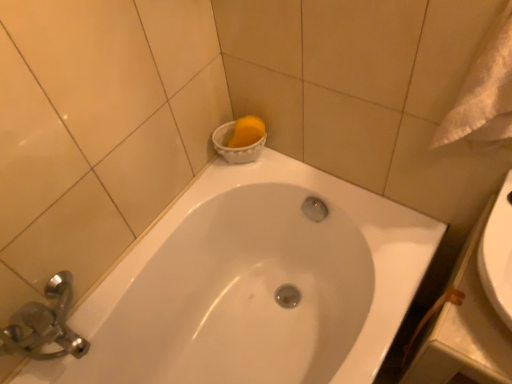
What do you see at coordinates (254, 285) in the screenshot? I see `white glossy bathtub at upper center` at bounding box center [254, 285].

At what (x,y) coordinates should I click in order to perform the action: click on white glossy bathtub at upper center. Please return your answer as a coordinate pair (x, y). Looking at the image, I should click on (254, 285).

The height and width of the screenshot is (384, 512). In order to click on white textured towel at upper right in this screenshot , I will do `click(484, 93)`.

This screenshot has height=384, width=512. Describe the element at coordinates (484, 93) in the screenshot. I see `white textured towel at upper right` at that location.

Where is `white glossy bathtub at upper center`? white glossy bathtub at upper center is located at coordinates (254, 285).

Between white glossy bathtub at upper center and white textured towel at upper right, which one appears on the left side from the viewer's perspective?

From the viewer's perspective, white glossy bathtub at upper center appears more on the left side.

Between white glossy bathtub at upper center and white textured towel at upper right, which one is positioned in front?

white textured towel at upper right is more forward.

Which is in front, point (434, 231) or point (492, 64)?

The point (492, 64) is closer.

From the image's perspective, which is below, white glossy bathtub at upper center or white textured towel at upper right?

white glossy bathtub at upper center.

Based on the photo, from a real-world perspective, which object stands above the other?

In real-world perspective, white textured towel at upper right is above.

Which object is thinner, white glossy bathtub at upper center or white textured towel at upper right?

With smaller width is white textured towel at upper right.

In terms of height, does white glossy bathtub at upper center look taller or shorter compared to white textured towel at upper right?

In the image, white glossy bathtub at upper center appears to be taller than white textured towel at upper right.

Does white glossy bathtub at upper center have a smaller size compared to white textured towel at upper right?

No.

Is white glossy bathtub at upper center situated inside white textured towel at upper right or outside?

white glossy bathtub at upper center cannot be found inside white textured towel at upper right.

Is white glossy bathtub at upper center not near white textured towel at upper right?

They are positioned close to each other.

Is white textured towel at upper right at the back of white glossy bathtub at upper center?

No, white glossy bathtub at upper center is not facing the opposite direction of white textured towel at upper right.

How different are the orientations of white glossy bathtub at upper center and white textured towel at upper right in degrees?

white glossy bathtub at upper center and white textured towel at upper right are facing 89.6 degrees away from each other.

Identify the location of bath towel located above the white glossy bathtub at upper center (from a real-world perspective). (484, 93).

Between white textured towel at upper right and white glossy bathtub at upper center, which one appears on the left side from the viewer's perspective?

Positioned to the left is white glossy bathtub at upper center.

Considering the positions of objects white textured towel at upper right and white glossy bathtub at upper center in the image provided, who is in front, white textured towel at upper right or white glossy bathtub at upper center?

white textured towel at upper right is closer to the camera.

Considering the points (436, 144) and (325, 381), which point is in front, point (436, 144) or point (325, 381)?

Positioned in front is point (436, 144).

From the image's perspective, would you say white textured towel at upper right is positioned over white glossy bathtub at upper center?

Indeed, from the image's perspective, white textured towel at upper right is shown above white glossy bathtub at upper center.

From a real-world perspective, is white textured towel at upper right on top of white glossy bathtub at upper center?

Yes, from a real-world perspective, white textured towel at upper right is above white glossy bathtub at upper center.

Based on the photo, does white textured towel at upper right have a lesser width compared to white glossy bathtub at upper center?

Yes.

Considering the relative sizes of white textured towel at upper right and white glossy bathtub at upper center in the image provided, is white textured towel at upper right taller than white glossy bathtub at upper center?

No, white textured towel at upper right is not taller than white glossy bathtub at upper center.

Considering the relative sizes of white textured towel at upper right and white glossy bathtub at upper center in the image provided, is white textured towel at upper right smaller than white glossy bathtub at upper center?

Yes, white textured towel at upper right is smaller than white glossy bathtub at upper center.

Could white glossy bathtub at upper center be considered to be inside white textured towel at upper right?

No.

Are white textured towel at upper right and white glossy bathtub at upper center far apart?

No, white textured towel at upper right is in close proximity to white glossy bathtub at upper center.

Is white textured towel at upper right looking in the opposite direction of white glossy bathtub at upper center?

That's not correct — white textured towel at upper right is not looking away from white glossy bathtub at upper center.

In order to click on bath towel on the right of white glossy bathtub at upper center in this screenshot , I will do `click(484, 93)`.

Image resolution: width=512 pixels, height=384 pixels. What are the coordinates of `bath towel lying above the white glossy bathtub at upper center (from the image's perspective)` in the screenshot? It's located at (484, 93).

This screenshot has width=512, height=384. In order to click on bath towel above the white glossy bathtub at upper center (from a real-world perspective) in this screenshot , I will do `click(484, 93)`.